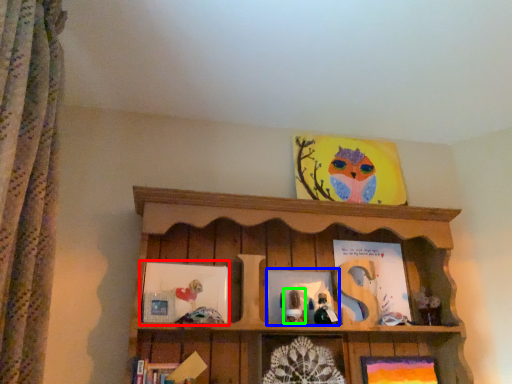
Question: Which object is positioned closest to picture frame (highlighted by a red box)? Select from picture frame (highlighted by a blue box) and toy (highlighted by a green box).

Choices:
 (A) picture frame
 (B) toy

Answer: (A)